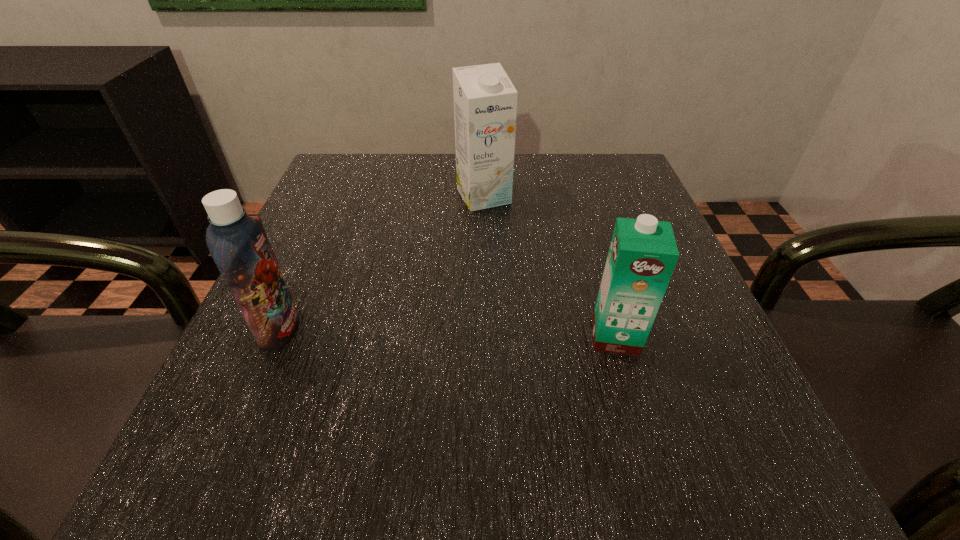
Where is `object present at the right edge`? object present at the right edge is located at coordinates (643, 253).

Locate an element on the screen. The image size is (960, 540). vacant space at the far edge of the desktop is located at coordinates (435, 192).

Where is `free space at the near edge of the desktop`? Image resolution: width=960 pixels, height=540 pixels. free space at the near edge of the desktop is located at coordinates (489, 445).

The image size is (960, 540). What are the coordinates of `free region at the left edge` in the screenshot? It's located at (323, 225).

Find the location of a particular element. blank space at the right edge of the desktop is located at coordinates (724, 354).

Where is `vacant position at the far left corner of the desktop`? The width and height of the screenshot is (960, 540). vacant position at the far left corner of the desktop is located at coordinates (348, 205).

You are a GUI agent. You are given a task and a screenshot of the screen. Output one action in this format:
    pyautogui.click(x=<x>, y=<y>)
    Task: Click on the vacant space at the near left corner of the desktop
    
    Given the screenshot: What is the action you would take?
    pyautogui.click(x=250, y=464)

In the image, there is a desktop. At what (x,y) coordinates should I click in order to perform the action: click on vacant space at the far right corner. Please return your answer as a coordinate pair (x, y). This screenshot has width=960, height=540. Looking at the image, I should click on (x=602, y=165).

I want to click on vacant space in between the shampoo and the rightmost object, so click(x=447, y=333).

The height and width of the screenshot is (540, 960). In order to click on vacant space that is in between the shampoo and the nearer carton in this screenshot , I will do `click(447, 333)`.